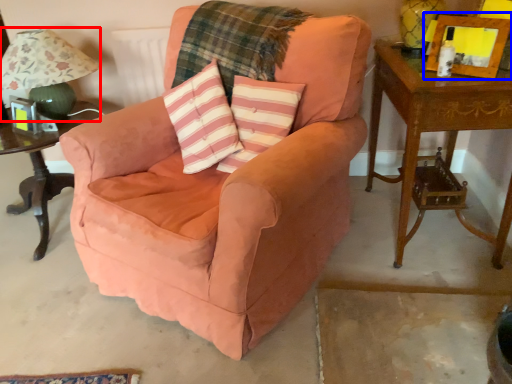
Question: Which of the following is the farthest to the observer, table lamp (highlighted by a red box) or picture frame (highlighted by a blue box)?

Choices:
 (A) table lamp
 (B) picture frame

Answer: (A)